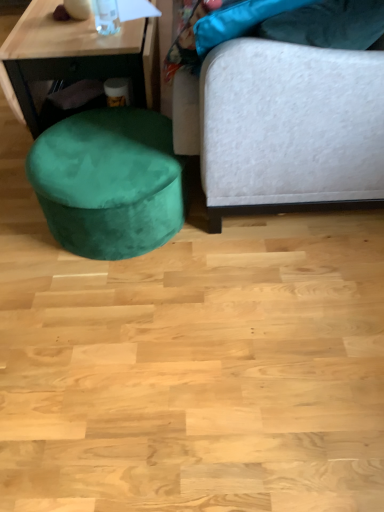
Identify the location of vacant space situated above velvet green ottoman at lower left (from a real-world perspective). The width and height of the screenshot is (384, 512). (99, 153).